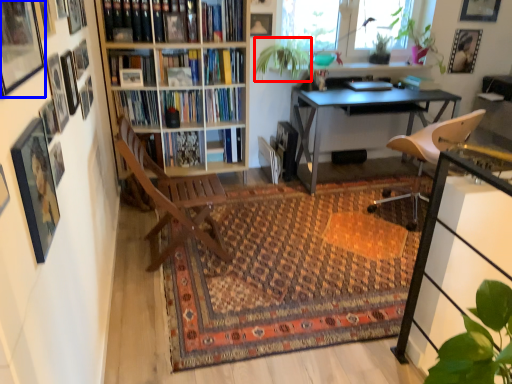
Question: Among these objects, which one is farthest to the camera, plant (highlighted by a red box) or picture frame (highlighted by a blue box)?

Choices:
 (A) plant
 (B) picture frame

Answer: (A)